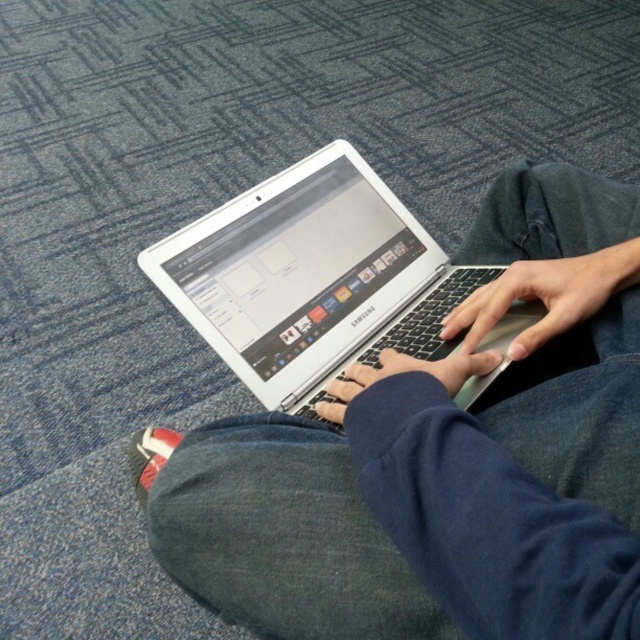
You are trying to decide which laptop to use for a presentation. You see a white glossy laptop at center and a silver metallic laptop at center. Which one is positioned to the right?

The white glossy laptop at center is to the right of the silver metallic laptop at center.

You are trying to decide which laptop to use for a presentation. You see a white glossy laptop at center and a silver metallic laptop at center. Which one is positioned lower on the screen?

The white glossy laptop at center is located below the silver metallic laptop at center, so it is positioned lower on the screen.

You are a photographer setting up a shot of the scene described. You want to ensure that the white glossy laptop at center is in focus while keeping the background slightly blurred. Given the distance between the laptop and the camera, what adjustment should you make to the camera settings to achieve this effect?

The white glossy laptop at center is 28.27 centimeters from the camera. To keep it in focus and blur the background, you should use a wide aperture setting to create a shallow depth of field.